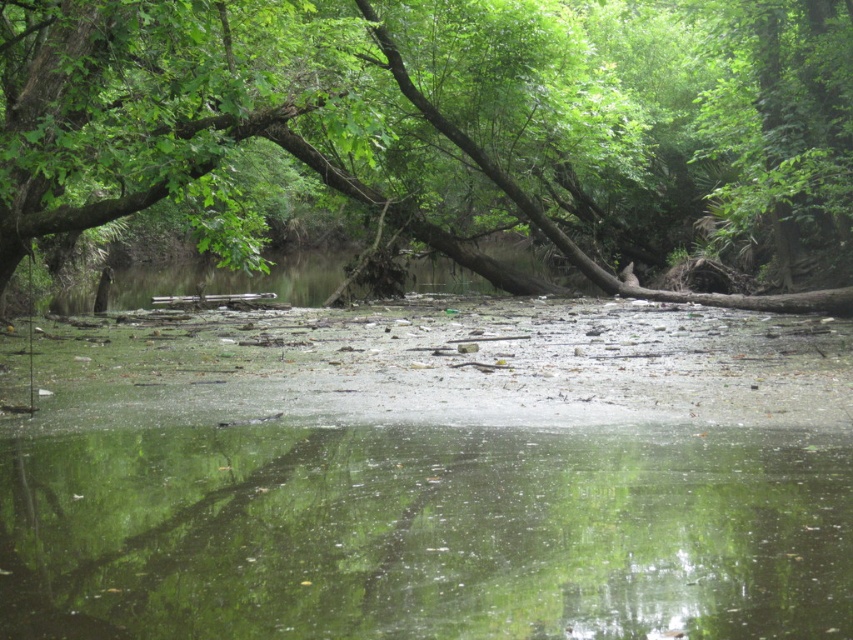
Between green leafy tree at center and transparent water at center, which one is positioned higher?

green leafy tree at center is above.

Is point (759, 220) less distant than point (405, 563)?

No, (759, 220) is further to viewer.

The image size is (853, 640). In order to click on green leafy tree at center in this screenshot , I will do `click(442, 124)`.